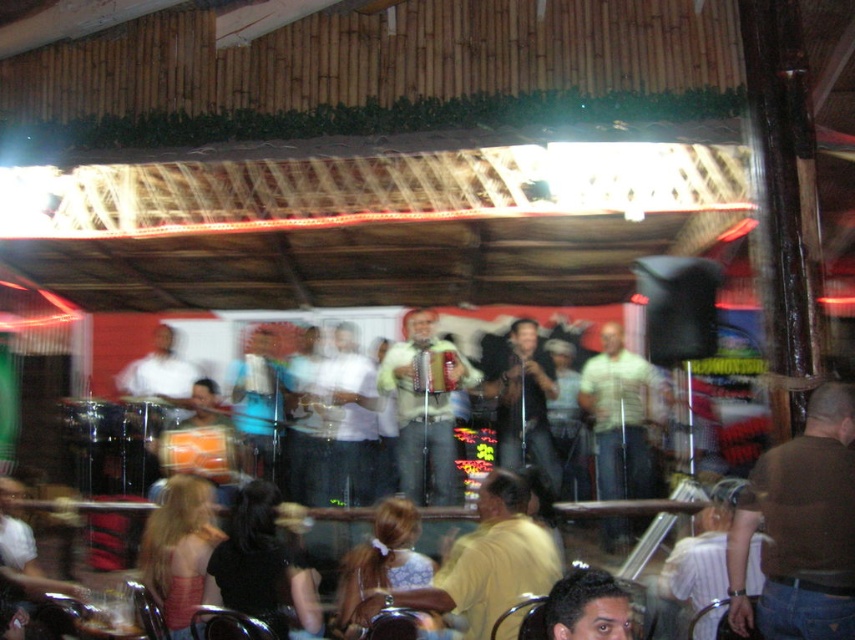
Question: Is yellow matte shirt at center to the left of light green shirt at center from the viewer's perspective?

Choices:
 (A) yes
 (B) no

Answer: (A)

Question: Which object appears closest to the camera in this image?

Choices:
 (A) light green shirt at center
 (B) light brown leather jacket at center
 (C) matte black shirt at center

Answer: (C)

Question: Which point is closer to the camera?

Choices:
 (A) [786, 483]
 (B) [404, 480]
 (C) [603, 492]

Answer: (A)

Question: Which of the following is the farthest from the observer?

Choices:
 (A) (351, 481)
 (B) (473, 552)

Answer: (A)

Question: In this image, where is brown leather shirt at lower right located relative to yellow matte shirt at center?

Choices:
 (A) right
 (B) left

Answer: (A)

Question: Can you confirm if yellow matte shirt at center is positioned to the left of white matte shirt at center?

Choices:
 (A) yes
 (B) no

Answer: (B)